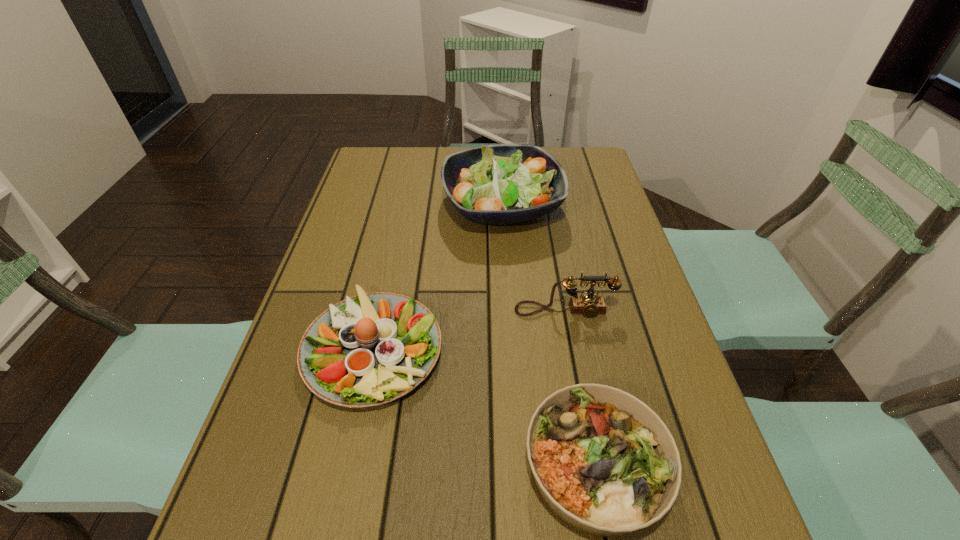
The image size is (960, 540). In order to click on telephone located at the right edge in this screenshot , I will do `click(588, 304)`.

This screenshot has height=540, width=960. I want to click on object situated at the far right corner, so click(x=498, y=184).

Locate an element on the screen. This screenshot has height=540, width=960. vacant region at the far edge is located at coordinates (437, 174).

Locate an element on the screen. This screenshot has height=540, width=960. vacant space at the left edge of the desktop is located at coordinates (313, 282).

Find the location of a particular element. The image size is (960, 540). free point at the right edge is located at coordinates (596, 219).

This screenshot has width=960, height=540. Identify the location of free region at the far left corner of the desktop. (372, 154).

Where is `free space between the telephone and the second shortest object`? This screenshot has height=540, width=960. free space between the telephone and the second shortest object is located at coordinates (469, 329).

You are a GUI agent. You are given a task and a screenshot of the screen. Output one action in this format:
    pyautogui.click(x=<x>, y=<y>)
    Task: Click on the vacant region between the farthest object and the telephone
    The width and height of the screenshot is (960, 540).
    Given the screenshot: What is the action you would take?
    pyautogui.click(x=533, y=258)

Identify the location of free space between the tallest salad plate and the telephone. The height and width of the screenshot is (540, 960). (533, 258).

Identify the location of free spot between the telephone and the second shortest salad plate. (469, 329).